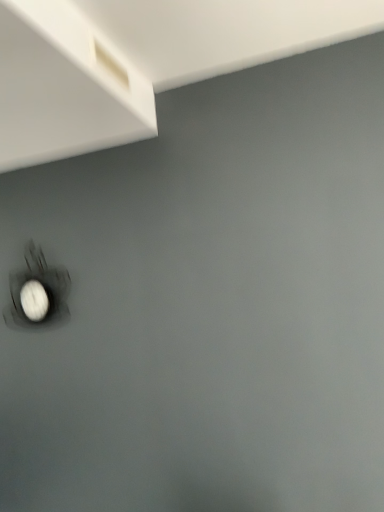
What is the approximate height of white glossy clock at lower left?

white glossy clock at lower left is 18.23 centimeters in height.

What do you see at coordinates (34, 300) in the screenshot? I see `white glossy clock at lower left` at bounding box center [34, 300].

Locate an element on the screen. white glossy clock at lower left is located at coordinates click(x=34, y=300).

Image resolution: width=384 pixels, height=512 pixels. What are the coordinates of `white glossy clock at lower left` in the screenshot? It's located at (34, 300).